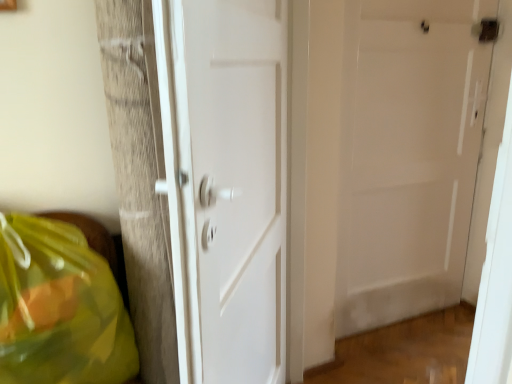
Question: In which direction should I rotate to look at white matte door at center, positioned as the 1th door in back-to-front order?

Choices:
 (A) left
 (B) right

Answer: (B)

Question: Can you confirm if white matte door at center, positioned as the 1th door in back-to-front order, is bigger than white glossy door at center, positioned as the 2th door in right-to-left order?

Choices:
 (A) no
 (B) yes

Answer: (A)

Question: Can you confirm if white matte door at center, positioned as the 1th door in back-to-front order, is positioned to the left of white glossy door at center, positioned as the 2th door in right-to-left order?

Choices:
 (A) no
 (B) yes

Answer: (A)

Question: Is white matte door at center, positioned as the 1th door in back-to-front order, closer to camera compared to white glossy door at center, acting as the 2th door starting from the back?

Choices:
 (A) no
 (B) yes

Answer: (A)

Question: Considering the relative positions of white matte door at center, positioned as the 1th door in back-to-front order, and white glossy door at center, the 1th door viewed from the front, in the image provided, is white matte door at center, positioned as the 1th door in back-to-front order, behind white glossy door at center, the 1th door viewed from the front,?

Choices:
 (A) yes
 (B) no

Answer: (A)

Question: From the image's perspective, would you say white matte door at center, placed as the second door when sorted from left to right, is positioned over white glossy door at center, the 1th door viewed from the front?

Choices:
 (A) yes
 (B) no

Answer: (A)

Question: From a real-world perspective, is white matte door at center, placed as the second door when sorted from front to back, located beneath white glossy door at center, the 1th door from the left?

Choices:
 (A) yes
 (B) no

Answer: (B)

Question: From the image's perspective, is white matte door at center, placed as the second door when sorted from left to right, located above translucent yellow plastic bag at lower left?

Choices:
 (A) no
 (B) yes

Answer: (B)

Question: Does white matte door at center, placed as the second door when sorted from front to back, have a larger size compared to translucent yellow plastic bag at lower left?

Choices:
 (A) yes
 (B) no

Answer: (B)

Question: Does white matte door at center, positioned as the 1th door in back-to-front order, have a greater height compared to translucent yellow plastic bag at lower left?

Choices:
 (A) no
 (B) yes

Answer: (B)

Question: From a real-world perspective, is white matte door at center, positioned as the 1th door in back-to-front order, beneath translucent yellow plastic bag at lower left?

Choices:
 (A) no
 (B) yes

Answer: (A)

Question: Is white matte door at center, placed as the second door when sorted from left to right, outside of translucent yellow plastic bag at lower left?

Choices:
 (A) no
 (B) yes

Answer: (B)

Question: Is white matte door at center, positioned as the 1th door in back-to-front order, oriented towards translucent yellow plastic bag at lower left?

Choices:
 (A) no
 (B) yes

Answer: (A)

Question: Is translucent yellow plastic bag at lower left facing towards white matte door at center, the first door positioned from the right?

Choices:
 (A) yes
 (B) no

Answer: (B)